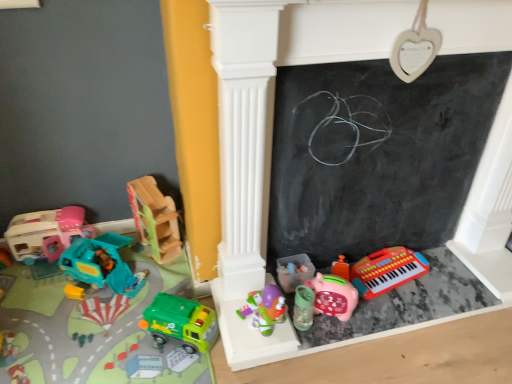
Question: Is pink plastic keyboard at lower right oriented away from wooden truck at left, the fifth toy in the right-to-left sequence?

Choices:
 (A) yes
 (B) no

Answer: (B)

Question: From the image's perspective, is pink plastic keyboard at lower right above wooden truck at left, acting as the 3th toy starting from the left?

Choices:
 (A) no
 (B) yes

Answer: (A)

Question: Is pink plastic keyboard at lower right not close to wooden truck at left, the fifth toy in the right-to-left sequence?

Choices:
 (A) no
 (B) yes

Answer: (A)

Question: Is wooden truck at left, acting as the 3th toy starting from the left, surrounded by pink plastic keyboard at lower right?

Choices:
 (A) yes
 (B) no

Answer: (B)

Question: From a real-world perspective, is pink plastic keyboard at lower right located higher than wooden truck at left, the fifth toy in the right-to-left sequence?

Choices:
 (A) yes
 (B) no

Answer: (B)

Question: From a real-world perspective, is black chalkboard at center positioned above or below green plastic toy truck at lower left, the fourth toy positioned from the left?

Choices:
 (A) below
 (B) above

Answer: (B)

Question: In terms of height, does black chalkboard at center look taller or shorter compared to green plastic toy truck at lower left, which is the 4th toy in right-to-left order?

Choices:
 (A) tall
 (B) short

Answer: (A)

Question: Based on their positions, is black chalkboard at center located to the left or right of green plastic toy truck at lower left, the fourth toy positioned from the left?

Choices:
 (A) left
 (B) right

Answer: (B)

Question: From the image's perspective, is black chalkboard at center located above or below green plastic toy truck at lower left, which is the 4th toy in right-to-left order?

Choices:
 (A) above
 (B) below

Answer: (A)

Question: Is pink plastic keyboard at lower right inside or outside of teal plastic truck at left, which appears as the second toy when viewed from the left?

Choices:
 (A) inside
 (B) outside

Answer: (B)

Question: Considering their positions, is pink plastic keyboard at lower right located in front of or behind teal plastic truck at left, the 6th toy in the right-to-left sequence?

Choices:
 (A) behind
 (B) front

Answer: (B)

Question: Is pink plastic keyboard at lower right taller or shorter than teal plastic truck at left, the 6th toy in the right-to-left sequence?

Choices:
 (A) tall
 (B) short

Answer: (B)

Question: Considering the positions of pink plastic keyboard at lower right and teal plastic truck at left, the 6th toy in the right-to-left sequence, in the image, is pink plastic keyboard at lower right bigger or smaller than teal plastic truck at left, the 6th toy in the right-to-left sequence,?

Choices:
 (A) small
 (B) big

Answer: (B)

Question: In the image, is teal plastic truck at left, which appears as the second toy when viewed from the left, positioned in front of or behind matte plastic playhouse at left, which is the first toy from left to right?

Choices:
 (A) front
 (B) behind

Answer: (A)

Question: Considering the positions of teal plastic truck at left, which appears as the second toy when viewed from the left, and matte plastic playhouse at left, which is the first toy from left to right, in the image, is teal plastic truck at left, which appears as the second toy when viewed from the left, bigger or smaller than matte plastic playhouse at left, which is the first toy from left to right,?

Choices:
 (A) small
 (B) big

Answer: (B)